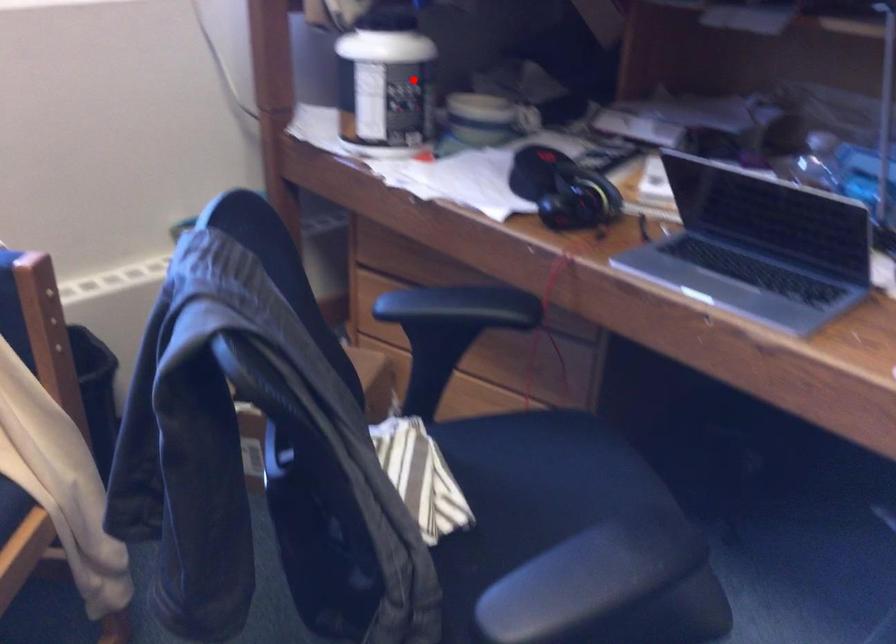
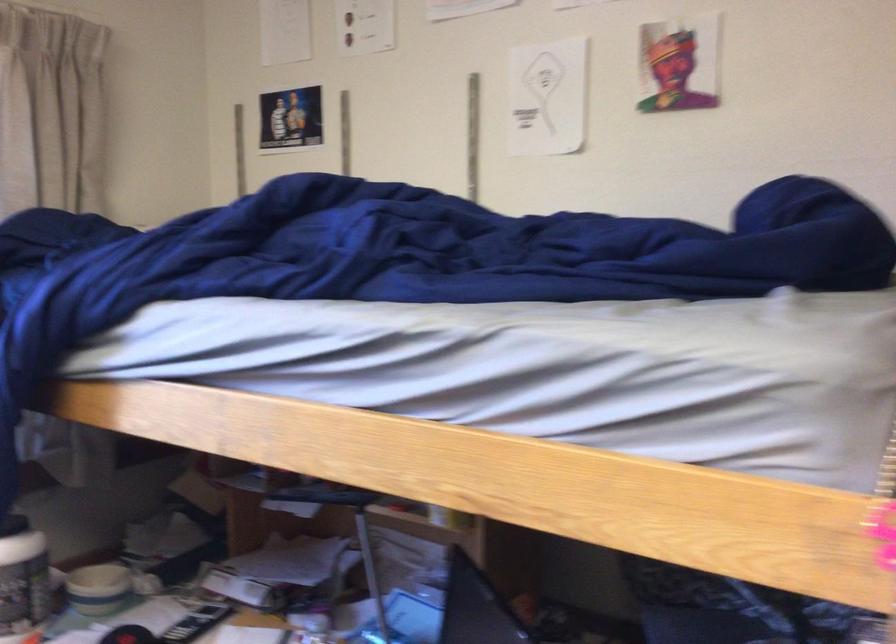
The point at the highlighted location is marked in the first image. Where is the corresponding point in the second image?

(22, 581)